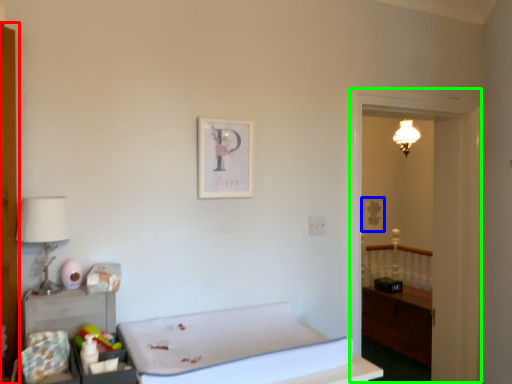
Question: Estimate the real-world distances between objects in this image. Which object is farther from armoire (highlighted by a red box), picture frame (highlighted by a blue box) or window (highlighted by a green box)?

Choices:
 (A) picture frame
 (B) window

Answer: (A)